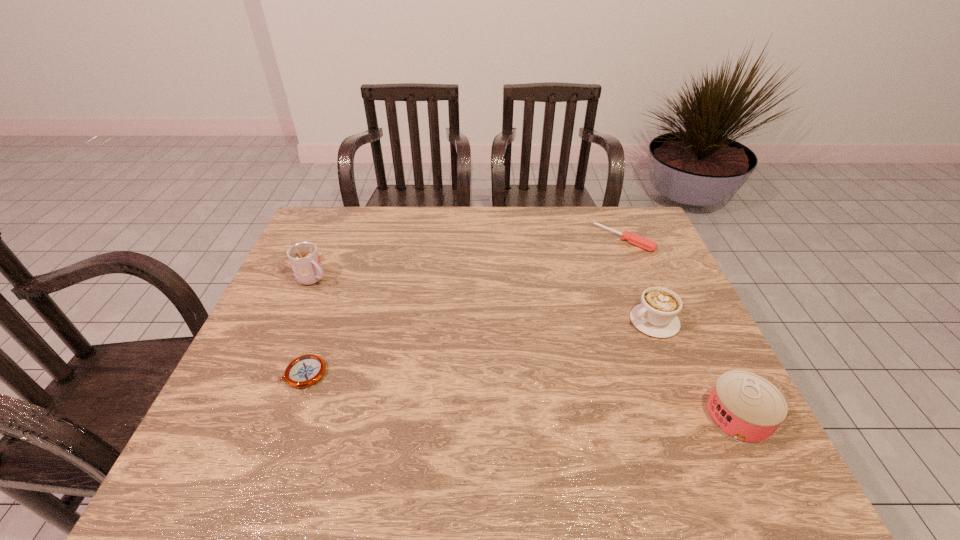
The width and height of the screenshot is (960, 540). In order to click on empty space that is in between the farthest object and the cappuccino in this screenshot , I will do `click(638, 280)`.

Locate an element on the screen. The image size is (960, 540). vacant space that is in between the farthest object and the shortest object is located at coordinates (464, 306).

Identify which object is the closest to the nearest object. Please provide its 2D coordinates. Your answer should be formatted as a tuple, i.e. [(x, y)], where the tuple contains the x and y coordinates of a point satisfying the conditions above.

[(656, 316)]

This screenshot has width=960, height=540. In order to click on object that is the second nearest to the farthest object in this screenshot , I will do `click(747, 408)`.

Find the location of a particular element. The width and height of the screenshot is (960, 540). free space in the image that satisfies the following two spatial constraints: 1. on the front side of the nearest object; 2. on the left side of the second nearest object is located at coordinates (288, 416).

Identify the location of free space that satisfies the following two spatial constraints: 1. on the back side of the third nearest object; 2. on the left side of the farthest object. Image resolution: width=960 pixels, height=540 pixels. (621, 239).